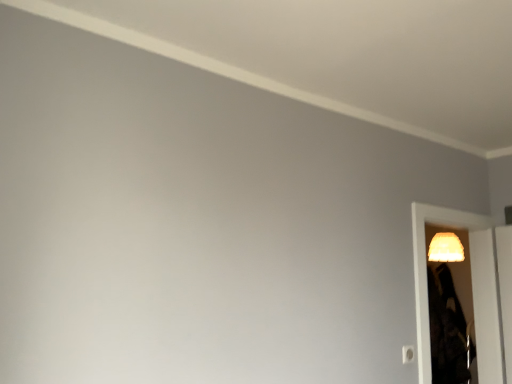
Question: Would you say matte yellow lampshade at right is inside or outside white plastic light switch at lower right?

Choices:
 (A) outside
 (B) inside

Answer: (A)

Question: Looking at their shapes, would you say matte yellow lampshade at right is wider or thinner than white plastic light switch at lower right?

Choices:
 (A) thin
 (B) wide

Answer: (B)

Question: Which object is the farthest from the matte yellow lampshade at right?

Choices:
 (A) white plastic light switch at lower right
 (B) translucent plastic screen door at right

Answer: (A)

Question: Estimate the real-world distances between objects in this image. Which object is closer to the translucent plastic screen door at right?

Choices:
 (A) matte yellow lampshade at right
 (B) white plastic light switch at lower right

Answer: (A)